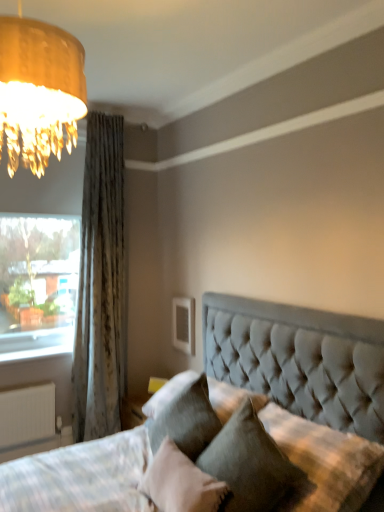
This screenshot has width=384, height=512. What do you see at coordinates (156, 384) in the screenshot? I see `yellow fabric table lamp at lower center` at bounding box center [156, 384].

What do you see at coordinates (41, 258) in the screenshot? The height and width of the screenshot is (512, 384). I see `clear glass window at left` at bounding box center [41, 258].

Find the location of `yellow fabric table lamp at lower center`. yellow fabric table lamp at lower center is located at coordinates (156, 384).

Is white matte radiator at lower left looking in the opposite direction of yellow fabric table lamp at lower center?

white matte radiator at lower left does not have its back to yellow fabric table lamp at lower center.

Is white matte radiator at lower left at the right side of yellow fabric table lamp at lower center?

In fact, white matte radiator at lower left is to the left of yellow fabric table lamp at lower center.

From the image's perspective, would you say white matte radiator at lower left is shown under yellow fabric table lamp at lower center?

Yes, from the image's perspective, white matte radiator at lower left is below yellow fabric table lamp at lower center.

Is yellow fabric table lamp at lower center located within white matte radiator at lower left?

Definitely not — yellow fabric table lamp at lower center is not inside white matte radiator at lower left.

From a real-world perspective, does tufted fabric pillow at center, positioned as the 1th pillow in right-to-left order, sit lower than clear glass window at left?

Indeed, from a real-world perspective, tufted fabric pillow at center, positioned as the 1th pillow in right-to-left order, is positioned beneath clear glass window at left.

Between point (281, 490) and point (49, 341), which one is positioned in front?

Positioned in front is point (281, 490).

From the image's perspective, which one is positioned lower, clear glass window at left or textured gray curtain at left?

textured gray curtain at left is shown below in the image.

Does point (44, 252) come in front of point (113, 261)?

That is False.

Considering the sizes of clear glass window at left and textured gray curtain at left in the image, is clear glass window at left taller or shorter than textured gray curtain at left?

In the image, clear glass window at left appears to be shorter than textured gray curtain at left.

Is velvet gray pillow at lower center, which is the 2th pillow from right to left, far away from yellow fabric table lamp at lower center?

velvet gray pillow at lower center, which is the 2th pillow from right to left, is near yellow fabric table lamp at lower center, not far away.

Based on the photo, from the image's perspective, which is below, velvet gray pillow at lower center, which is the 2th pillow from right to left, or yellow fabric table lamp at lower center?

yellow fabric table lamp at lower center appears lower in the image.

Which of these two, velvet gray pillow at lower center, which ranks as the 1th pillow in left-to-right order, or yellow fabric table lamp at lower center, is thinner?

With smaller width is yellow fabric table lamp at lower center.

How different are the orientations of velvet gray pillow at lower center, which ranks as the 1th pillow in left-to-right order, and yellow fabric table lamp at lower center in degrees?

The facing directions of velvet gray pillow at lower center, which ranks as the 1th pillow in left-to-right order, and yellow fabric table lamp at lower center are 33.4 degrees apart.

Can you confirm if white matte radiator at lower left is thinner than clear glass window at left?

Indeed, white matte radiator at lower left has a lesser width compared to clear glass window at left.

Is clear glass window at left completely or partially inside white matte radiator at lower left?

No, clear glass window at left is not a part of white matte radiator at lower left.

Between white matte radiator at lower left and clear glass window at left, which one has larger size?

clear glass window at left is bigger.

Is white matte radiator at lower left further to the viewer compared to clear glass window at left?

No, it is in front of clear glass window at left.

Between textured gray curtain at left and tufted fabric pillow at center, positioned as the 1th pillow in right-to-left order, which one appears on the left side from the viewer's perspective?

textured gray curtain at left.

From a real-world perspective, is textured gray curtain at left above or below tufted fabric pillow at center, positioned as the 1th pillow in right-to-left order?

Clearly, from a real-world perspective, textured gray curtain at left is above tufted fabric pillow at center, positioned as the 1th pillow in right-to-left order.

Is textured gray curtain at left bigger or smaller than tufted fabric pillow at center, positioned as the 1th pillow in right-to-left order?

textured gray curtain at left is bigger than tufted fabric pillow at center, positioned as the 1th pillow in right-to-left order.

Is textured gray curtain at left oriented away from tufted fabric pillow at center, the second pillow from the left?

textured gray curtain at left is not turned away from tufted fabric pillow at center, the second pillow from the left.

At what (x,y) coordinates should I click in order to perform the action: click on radiator directly beneath the yellow fabric table lamp at lower center (from a real-world perspective). Please return your answer as a coordinate pair (x, y). Image resolution: width=384 pixels, height=512 pixels. Looking at the image, I should click on (27, 414).

Would you say yellow fabric table lamp at lower center is inside or outside white matte radiator at lower left?

yellow fabric table lamp at lower center exists outside the volume of white matte radiator at lower left.

Looking at this image, in terms of width, does yellow fabric table lamp at lower center look wider or thinner when compared to white matte radiator at lower left?

Clearly, yellow fabric table lamp at lower center has less width compared to white matte radiator at lower left.

Which is nearer, (154, 389) or (45, 411)?

Clearly, point (154, 389) is closer to the camera than point (45, 411).

You are a GUI agent. You are given a task and a screenshot of the screen. Output one action in this format:
    pyautogui.click(x=<x>, y=<y>)
    Task: Click on the table lamp behind the white matte radiator at lower left
    This screenshot has height=512, width=384.
    Given the screenshot: What is the action you would take?
    pyautogui.click(x=156, y=384)

Find the location of a particular element. This screenshot has height=512, width=384. window that is on the left side of tufted fabric pillow at center, the second pillow from the left is located at coordinates (41, 258).

Which object lies nearer to the anchor point white matte radiator at lower left, tufted fabric pillow at center, positioned as the 1th pillow in right-to-left order, or textured gray curtain at left?

textured gray curtain at left is closer to white matte radiator at lower left.

Considering their positions, is white matte radiator at lower left positioned further to yellow fabric table lamp at lower center than textured gray curtain at left?

white matte radiator at lower left is further to yellow fabric table lamp at lower center.

Looking at the image, which one is located further to textured gray curtain at left, clear glass window at left or white matte radiator at lower left?

white matte radiator at lower left is further to textured gray curtain at left.

From the image, which object appears to be nearer to tufted fabric pillow at center, the second pillow from the left, textured gray curtain at left or white matte radiator at lower left?

Based on the image, textured gray curtain at left appears to be nearer to tufted fabric pillow at center, the second pillow from the left.

Looking at this image, which object lies further to the anchor point velvet gray pillow at lower center, which is the 2th pillow from right to left, clear glass window at left or yellow fabric table lamp at lower center?

Among the two, clear glass window at left is located further to velvet gray pillow at lower center, which is the 2th pillow from right to left.

Estimate the real-world distances between objects in this image. Which object is closer to velvet gray pillow at lower center, which is the 2th pillow from right to left, clear glass window at left or textured gray curtain at left?

textured gray curtain at left is closer to velvet gray pillow at lower center, which is the 2th pillow from right to left.

Which object lies further to the anchor point tufted fabric pillow at center, the second pillow from the left, white matte radiator at lower left or velvet gray pillow at lower center, which ranks as the 1th pillow in left-to-right order?

white matte radiator at lower left is further to tufted fabric pillow at center, the second pillow from the left.

Based on their spatial positions, is velvet gray pillow at lower center, which ranks as the 1th pillow in left-to-right order, or textured gray curtain at left further from tufted fabric pillow at center, positioned as the 1th pillow in right-to-left order?

textured gray curtain at left lies further to tufted fabric pillow at center, positioned as the 1th pillow in right-to-left order, than the other object.

At what (x,y) coordinates should I click in order to perform the action: click on curtain positioned between tufted fabric pillow at center, the second pillow from the left, and yellow fabric table lamp at lower center from near to far. Please return your answer as a coordinate pair (x, y). The height and width of the screenshot is (512, 384). Looking at the image, I should click on (101, 284).

Identify the location of radiator between tufted fabric pillow at center, positioned as the 1th pillow in right-to-left order, and yellow fabric table lamp at lower center from front to back. (27, 414).

This screenshot has width=384, height=512. What are the coordinates of `radiator between velvet gray pillow at lower center, which ranks as the 1th pillow in left-to-right order, and textured gray curtain at left from front to back` in the screenshot? It's located at [27, 414].

Where is `window positioned between velvet gray pillow at lower center, which is the 2th pillow from right to left, and yellow fabric table lamp at lower center from near to far`? window positioned between velvet gray pillow at lower center, which is the 2th pillow from right to left, and yellow fabric table lamp at lower center from near to far is located at coordinates (41, 258).